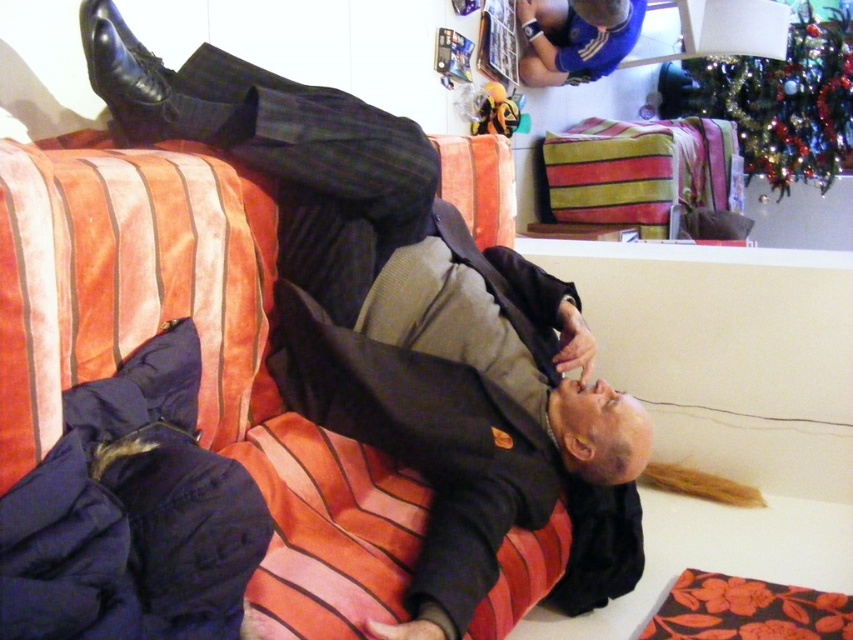
You are a guest in this room and want to place a small gift on the table behind the blue jersey at upper center. Can you do that without moving the velvet striped couch at center?

The velvet striped couch at center is in front of the blue jersey at upper center, so you can place the gift on the table behind the blue jersey at upper center without moving the couch since it is positioned in front of the jersey, not blocking the table.